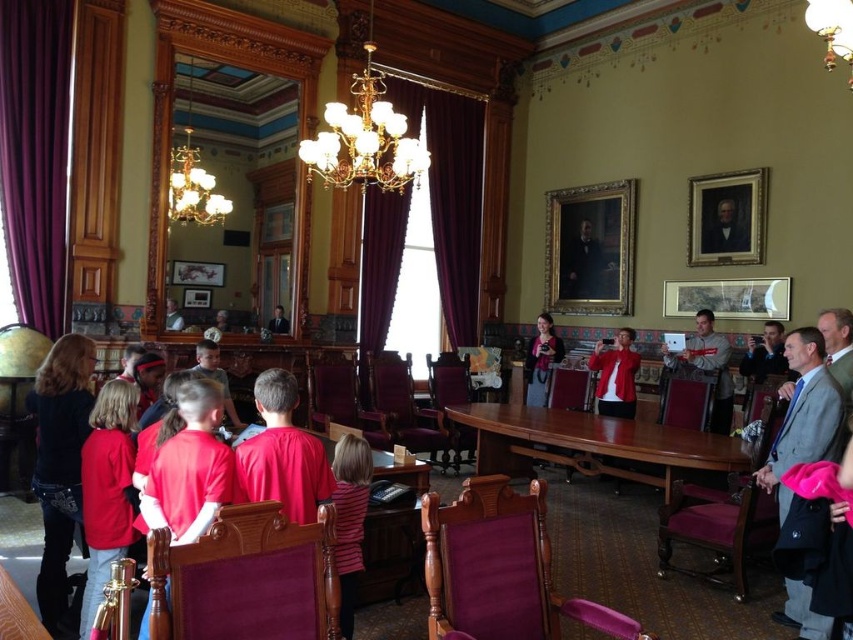
Does gold metallic chandelier at upper center appear on the left side of striped fabric shirt at lower center?

Correct, you'll find gold metallic chandelier at upper center to the left of striped fabric shirt at lower center.

Is gold metallic chandelier at upper center taller than striped fabric shirt at lower center?

Incorrect, gold metallic chandelier at upper center's height is not larger of striped fabric shirt at lower center's.

Is point (369, 144) closer to camera compared to point (347, 552)?

No, (369, 144) is further to viewer.

The image size is (853, 640). I want to click on gold metallic chandelier at upper center, so click(364, 140).

Can you confirm if gold metallic chandelier at upper center is bigger than matte red shirt at center?

Indeed, gold metallic chandelier at upper center has a larger size compared to matte red shirt at center.

Between gold metallic chandelier at upper center and matte red shirt at center, which one is positioned higher?

A: Positioned higher is gold metallic chandelier at upper center.

Identify the location of gold metallic chandelier at upper center. (364, 140).

Is matte red shirt at center closer to camera compared to striped fabric shirt at lower center?

No.

Does matte red shirt at center have a lesser width compared to striped fabric shirt at lower center?

Incorrect, matte red shirt at center's width is not less than striped fabric shirt at lower center's.

Who is more distant from viewer, (108, 568) or (364, 472)?

The point (364, 472) is behind.

The width and height of the screenshot is (853, 640). Find the location of `matte red shirt at center`. matte red shirt at center is located at coordinates (106, 490).